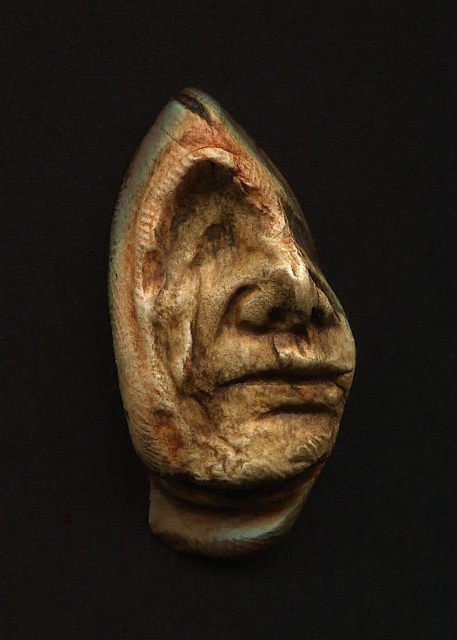
Looking at this image, you are an art restorer examining two clay masks in the image. The first is a rusty clay mask at center and the second is an earthy clay mask at center. Which mask is positioned to the left?

The rusty clay mask at center is positioned to the left of the earthy clay mask at center.

You are an art conservator examining the sculpture. The museum requires all artifacts to be placed at the exact center coordinates of the display case, which is at point 0.5, 0.5. Is the rusty clay mask at center positioned correctly?

The rusty clay mask at center is located at point [222,333], which is slightly off the exact center coordinates of [228,320]. Therefore, it is not positioned correctly according to the museum requirements.